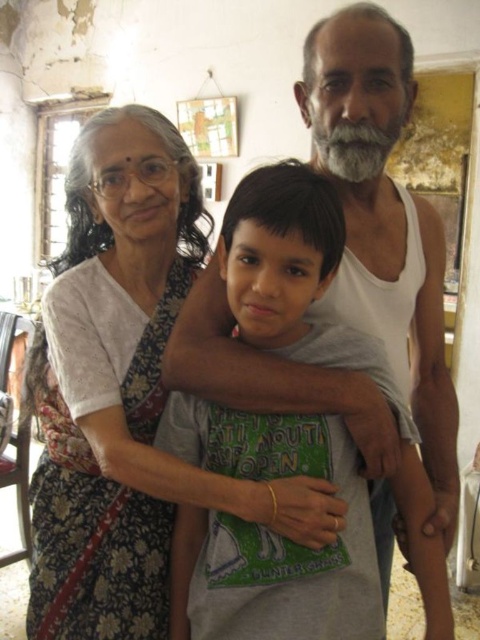
Consider the image. You are trying to decide which clothing item takes up more horizontal space in the image. Based on the scene, which one is wider between the white cotton tank top at center and the white printed saree at left?

The white cotton tank top at center might be wider than white printed saree at left according to the description.

Based on the photo, you are a photographer trying to capture a clear shot of the white cotton tank top at center and the white printed saree at left. Which clothing item is closer to the camera?

The white cotton tank top at center is closer to the camera since it is in front of the white printed saree at left.